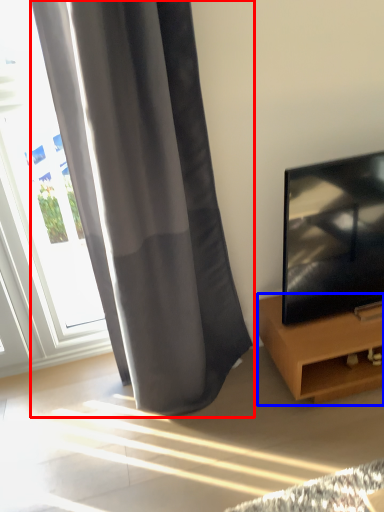
Question: Which object is further to the camera taking this photo, curtain (highlighted by a red box) or furniture (highlighted by a blue box)?

Choices:
 (A) curtain
 (B) furniture

Answer: (B)